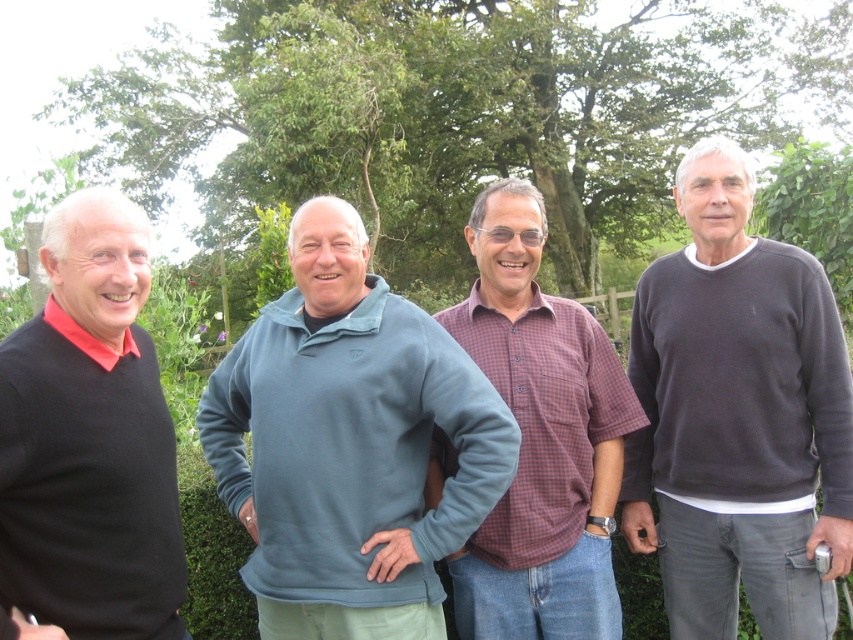
You are organizing a group photo and need to arrange the men based on their clothing sizes. Given that the dark gray sweater at right and the plaid cotton shirt at center are two of them, which man should stand in the front row to ensure visibility?

The plaid cotton shirt at center should stand in the front row because the dark gray sweater at right is larger in size and would block the view if placed in front.